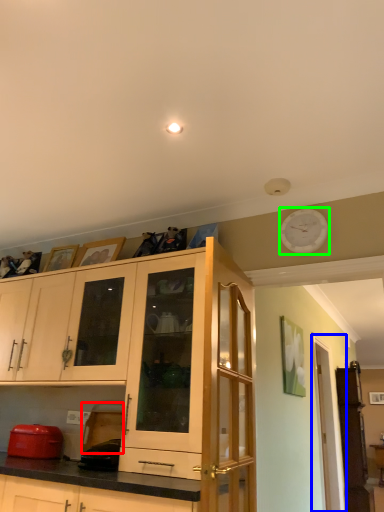
Question: Estimate the real-world distances between objects in this image. Which object is farther from appliance (highlighted by a red box), glass door (highlighted by a blue box) or clock (highlighted by a green box)?

Choices:
 (A) glass door
 (B) clock

Answer: (A)